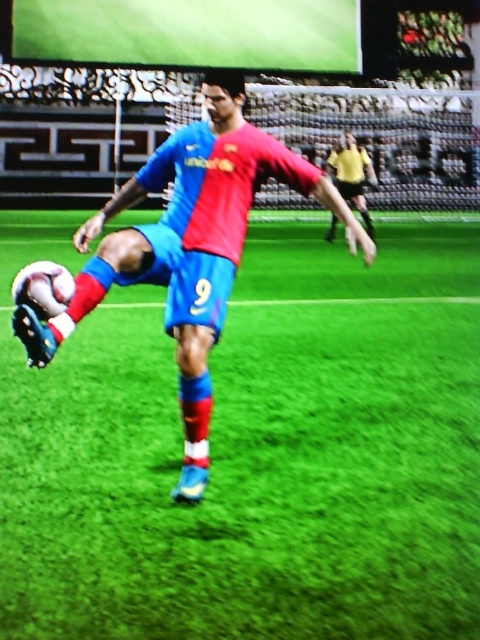
Question: Is green artificial turf at center bigger than shiny blue shorts at center?

Choices:
 (A) no
 (B) yes

Answer: (B)

Question: Which object appears closest to the camera in this image?

Choices:
 (A) shiny blue shorts at center
 (B) green artificial turf at center

Answer: (B)

Question: Can you confirm if green artificial turf at center is wider than shiny blue shorts at center?

Choices:
 (A) yes
 (B) no

Answer: (A)

Question: Is green artificial turf at center above shiny blue shorts at center?

Choices:
 (A) no
 (B) yes

Answer: (A)

Question: Which point is closer to the camera?

Choices:
 (A) (415, 289)
 (B) (189, 316)

Answer: (B)

Question: Which point is farther to the camera?

Choices:
 (A) green artificial turf at center
 (B) shiny blue shorts at center

Answer: (B)